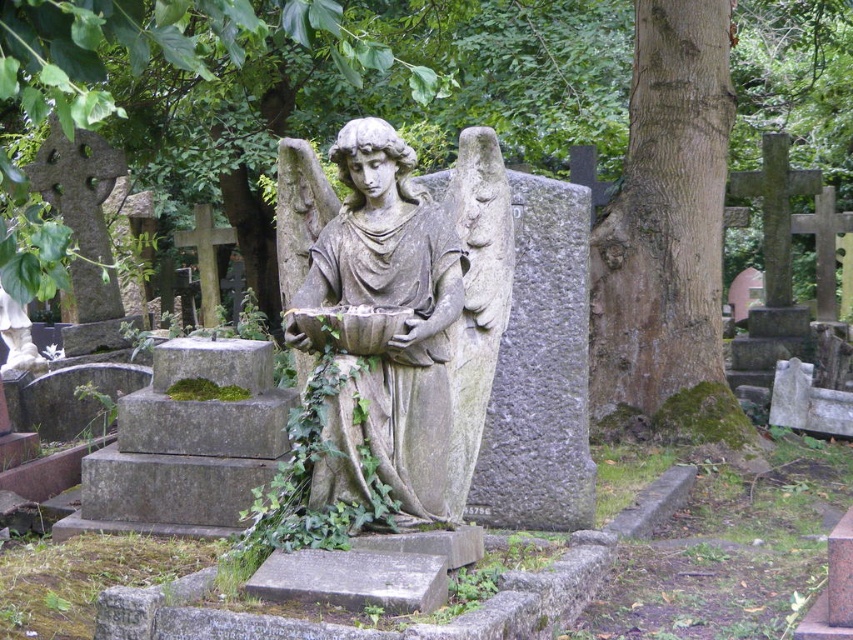
You are a visitor to the cemetery and want to place a flower at the base of the stone statue at center. However, you notice the green mossy bark at center nearby. Considering their sizes, which object should you avoid stepping on to prevent damage?

The stone statue at center is smaller than the green mossy bark at center. To prevent damage, avoid stepping on the stone statue at center since it is smaller and more fragile.

You are standing in the cemetery and want to take a photo of the stone statue at center without the green mossy bark at center appearing in the background. Is this possible based on their positions?

The stone statue at center is in front of green mossy bark at center, so yes, you can take a photo of the stone statue at center without the green mossy bark at center in the background by positioning yourself so that the statue blocks the view of the bark.